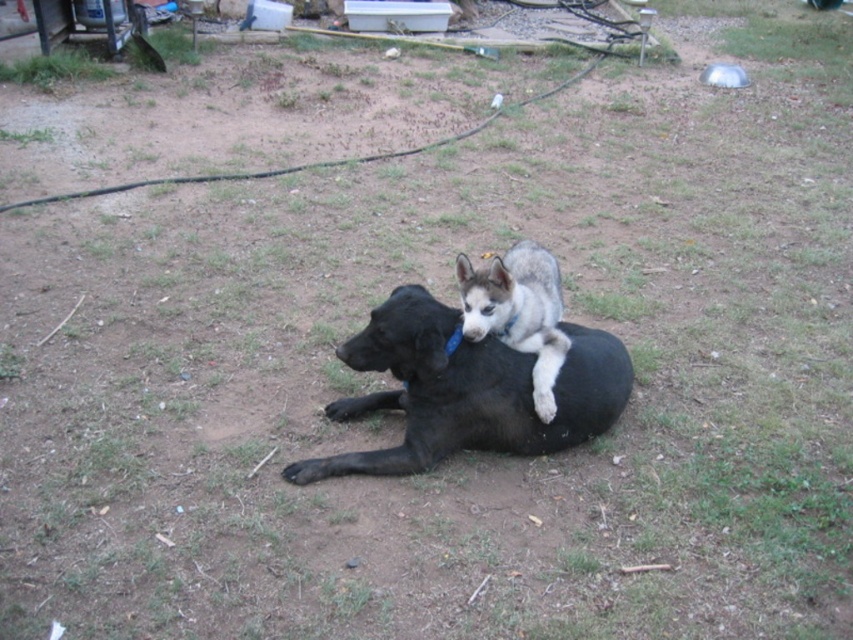
Question: Does black matte dog at center have a larger size compared to gray fur dog at center?

Choices:
 (A) no
 (B) yes

Answer: (B)

Question: Can you confirm if black matte dog at center is positioned below gray fur dog at center?

Choices:
 (A) no
 (B) yes

Answer: (B)

Question: Which point is closer to the camera?

Choices:
 (A) (508, 413)
 (B) (538, 257)

Answer: (A)

Question: Can you confirm if black matte dog at center is wider than gray fur dog at center?

Choices:
 (A) yes
 (B) no

Answer: (A)